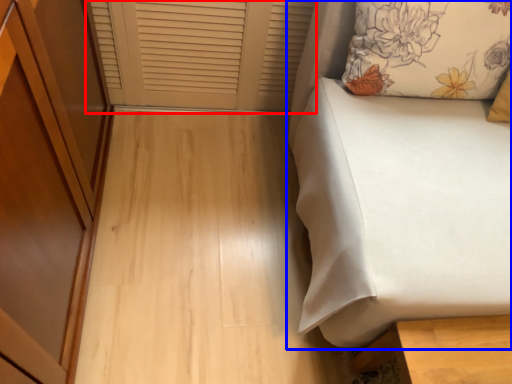
Question: Which object is further to the camera taking this photo, window frame (highlighted by a red box) or furniture (highlighted by a blue box)?

Choices:
 (A) window frame
 (B) furniture

Answer: (A)